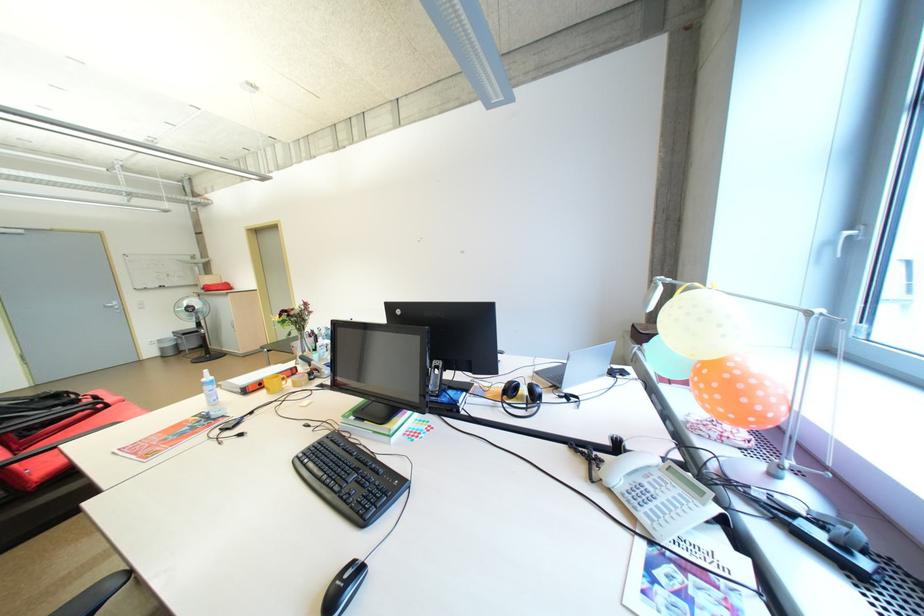
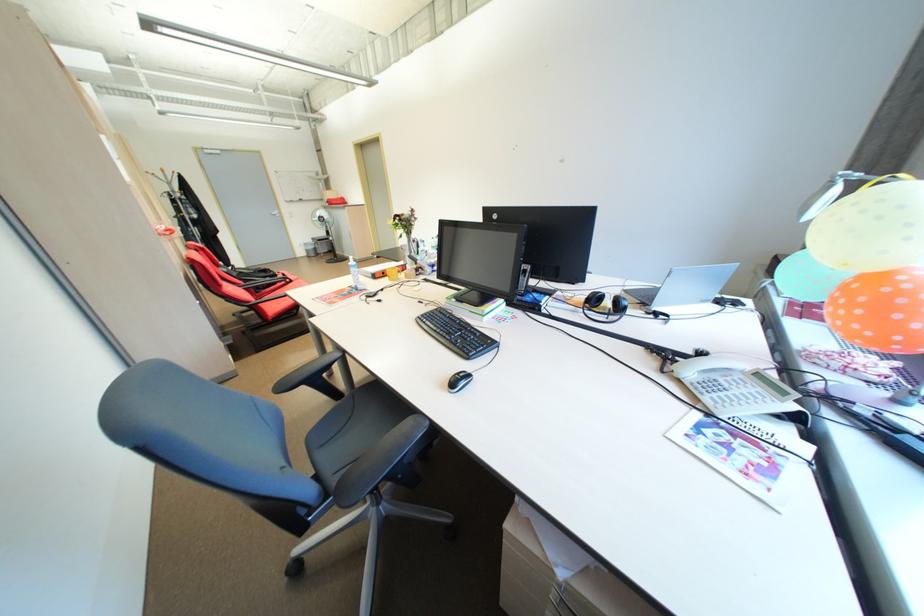
In the second image, find the point that corresponds to point 754,400 in the first image.

(906, 317)